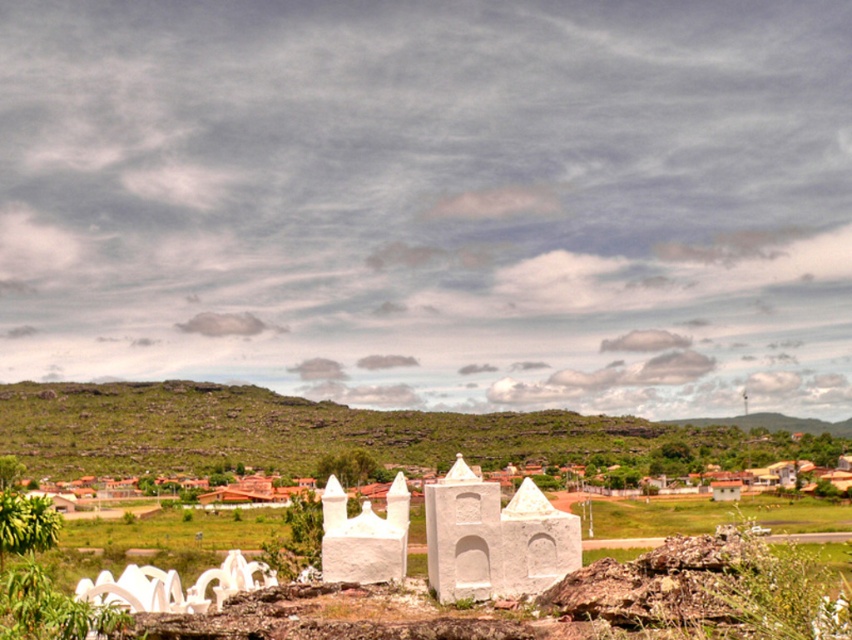
You are planning to place a picnic blanket on the green grassy hillside at lower center and the white stone chapel at center. Which location has enough space to accommodate a large picnic blanket?

The green grassy hillside at lower center is bigger than the white stone chapel at center, so it has enough space to accommodate a large picnic blanket.

You are standing in the landscape scene and want to walk from point A to point B. Point A is at coordinates point (235, 385) and point B is at coordinates point (467, 532). Which point is closer to you when you start walking?

Point A at coordinates point (235, 385) is closer to you than point B at coordinates point (467, 532) because it is further to the camera, meaning it is physically nearer to your position.